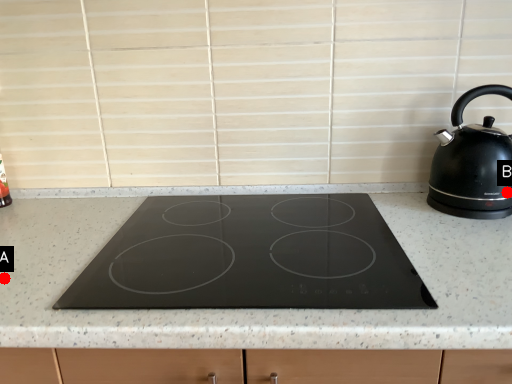
Question: Two points are circled on the image, labeled by A and B beside each circle. Which of the following is the closest to the observer?

Choices:
 (A) A is closer
 (B) B is closer

Answer: (A)